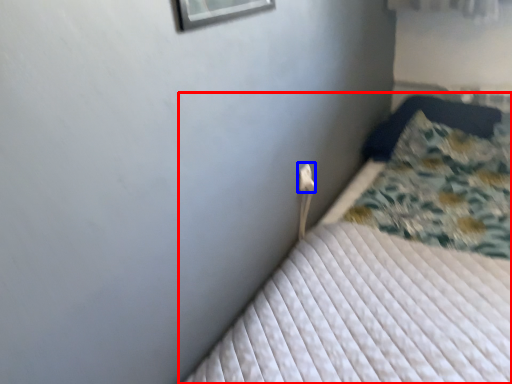
Question: Which of the following is the farthest to the observer, bed (highlighted by a red box) or electric outlet (highlighted by a blue box)?

Choices:
 (A) bed
 (B) electric outlet

Answer: (B)